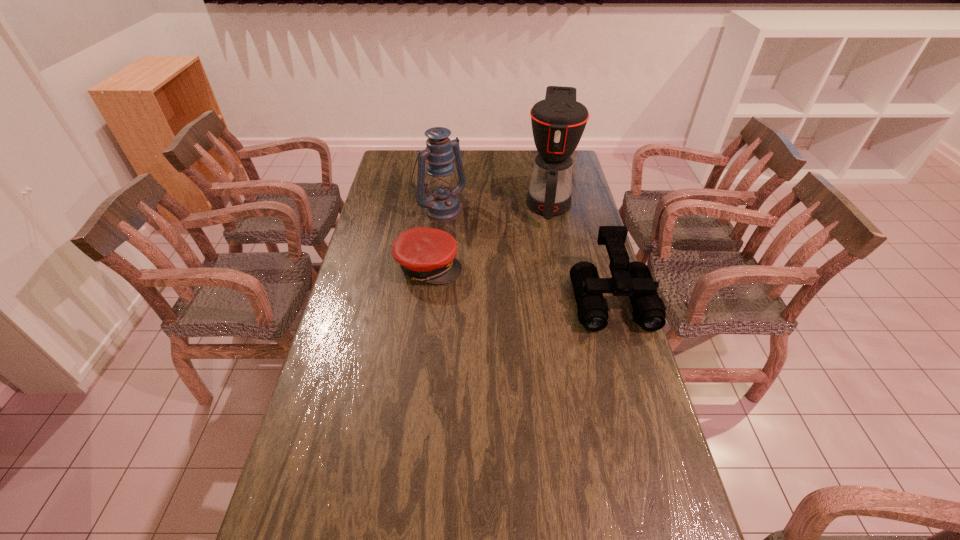
The height and width of the screenshot is (540, 960). Find the location of `cap`. cap is located at coordinates (425, 254).

Where is `the third tallest object`? the third tallest object is located at coordinates (633, 279).

The width and height of the screenshot is (960, 540). In order to click on lantern in this screenshot , I will do `click(442, 205)`.

Locate an element on the screen. Image resolution: width=960 pixels, height=540 pixels. coffee maker is located at coordinates (558, 122).

Identify the location of vacant region located on the front of the shortest object with an emblem. This screenshot has width=960, height=540. (504, 266).

Locate an element on the screen. The height and width of the screenshot is (540, 960). vacant space situated on the front lenses of the binoculars is located at coordinates [x=651, y=434].

Locate an element on the screen. This screenshot has width=960, height=540. free space located 0.350m on the front-facing side of the second tallest object is located at coordinates (510, 265).

The image size is (960, 540). Find the location of `vacant space located on the front-facing side of the second tallest object`. vacant space located on the front-facing side of the second tallest object is located at coordinates click(492, 249).

This screenshot has width=960, height=540. In order to click on free space located on the front-facing side of the second tallest object in this screenshot , I will do `click(492, 249)`.

Where is `vacant area situated 0.180m pour from the carafe of the coffee maker`? The height and width of the screenshot is (540, 960). vacant area situated 0.180m pour from the carafe of the coffee maker is located at coordinates point(547,261).